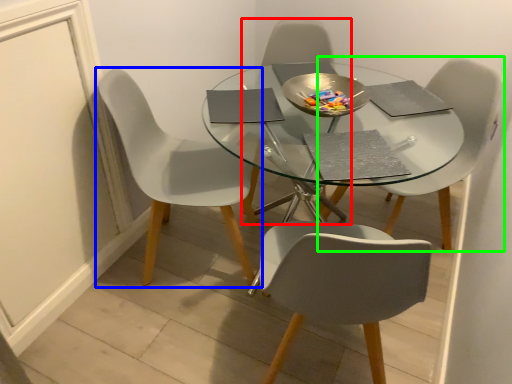
Question: Which object is the farthest from chair (highlighted by a red box)? Choose among these: chair (highlighted by a blue box) or chair (highlighted by a green box).

Choices:
 (A) chair
 (B) chair

Answer: (B)